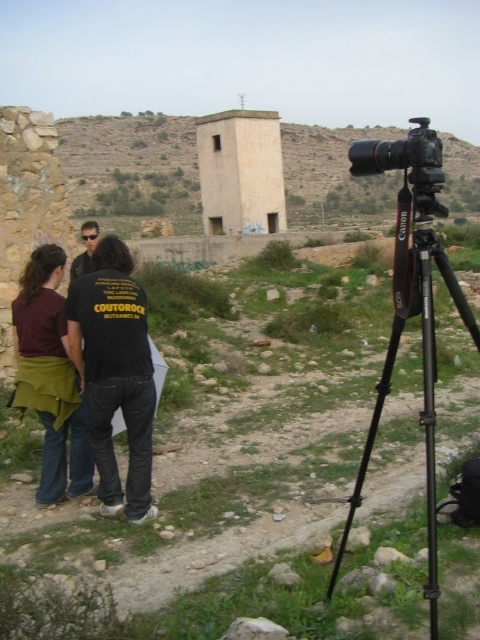
You are a photographer standing at the base of the brown rocky hill at upper center and want to take a photo of the black cotton shirt at center. Since the shirt is lower, will it be visible in the photo if you point the camera straight ahead?

The brown rocky hill at upper center has a greater height compared to the black cotton shirt at center, so the shirt might be partially or fully obscured by the hill if the camera is pointed straight ahead.